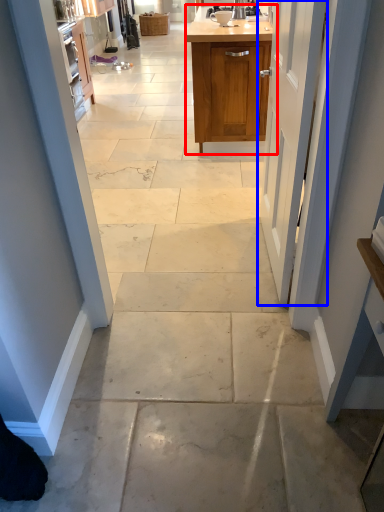
Question: Among these objects, which one is nearest to the camera, cabinetry (highlighted by a red box) or door (highlighted by a blue box)?

Choices:
 (A) cabinetry
 (B) door

Answer: (B)